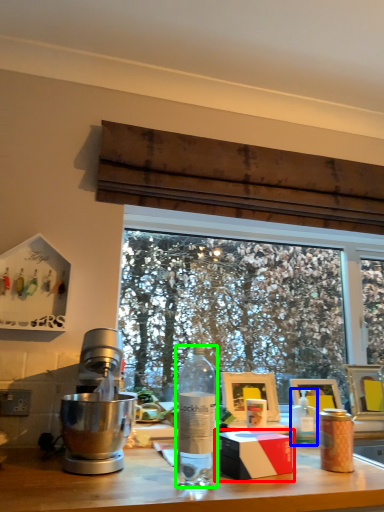
Question: Considering the real-world distances, which object is farthest from box (highlighted by a red box)? bottle (highlighted by a blue box) or bottle (highlighted by a green box)?

Choices:
 (A) bottle
 (B) bottle

Answer: (A)